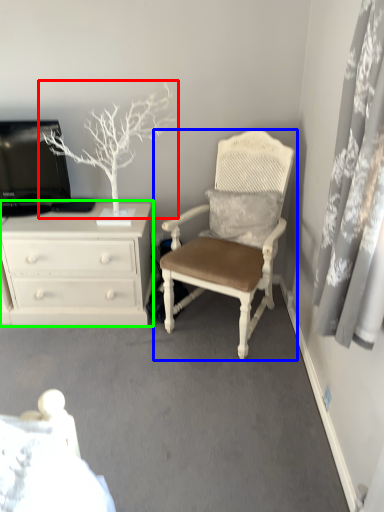
Question: Considering the real-world distances, which object is closest to tree (highlighted by a red box)? chair (highlighted by a blue box) or chest of drawers (highlighted by a green box).

Choices:
 (A) chair
 (B) chest of drawers

Answer: (B)